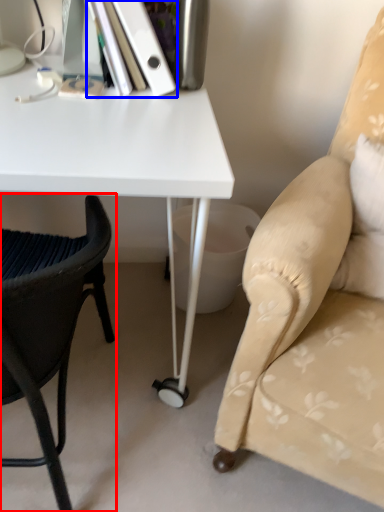
Question: Which point is closer to the camera, chair (highlighted by a red box) or paperback book (highlighted by a blue box)?

Choices:
 (A) chair
 (B) paperback book

Answer: (A)